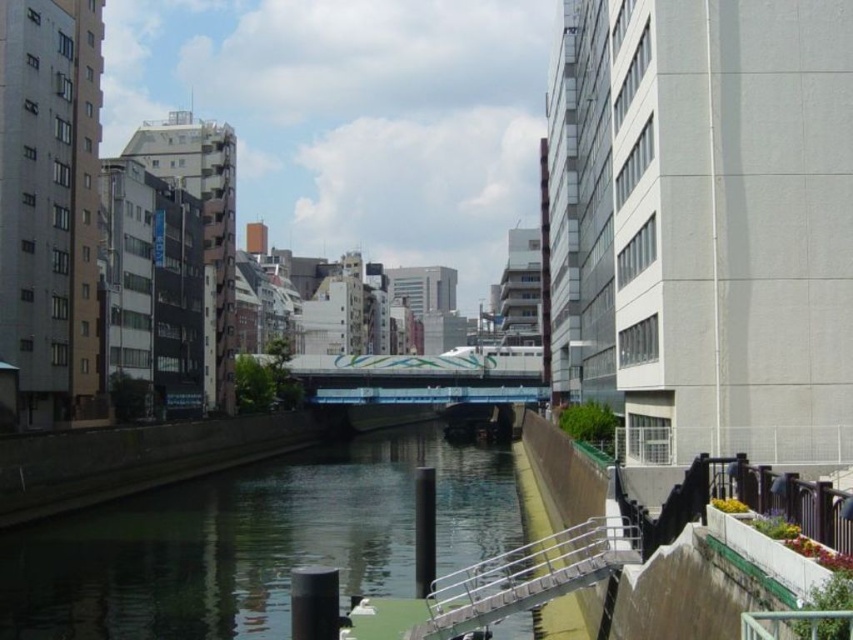
You are a drone operator planning to fly a drone over the urban canal scene. The drone has a maximum flight distance of 150 feet from the operator. If you are standing at the camera position, will the drone be able to reach the green smooth water at center without exceeding its maximum range?

The distance between the green smooth water at center and the camera is 172.82 feet, which exceeds the drone operator maximum flight range of 150 feet. Therefore, the drone will not be able to reach the green smooth water at center without exceeding its limit.

You are a tourist standing on the bridge and want to take a photo of the green smooth water at center and the silver metallic railing at lower center. Which object should you focus on first to ensure it appears larger in your photo?

The green smooth water at center is further to the viewer than the silver metallic railing at lower center, so focusing on the green smooth water at center first will make it appear larger in the photo.

You are a delivery person carrying a large package that is 2 meters wide. You need to cross the pedestrian bridge to reach the other side of the canal. Can you pass through the area between the green smooth water at center and the silver metallic railing at lower center without tilting the package?

The green smooth water at center is wider than the silver metallic railing at lower center. However, the question is about passing through the area between them, which likely refers to the space under the bridge. Since the width of the water and railing aren not directly related to the bridge passage width, the answer cannot be determined from the given information.